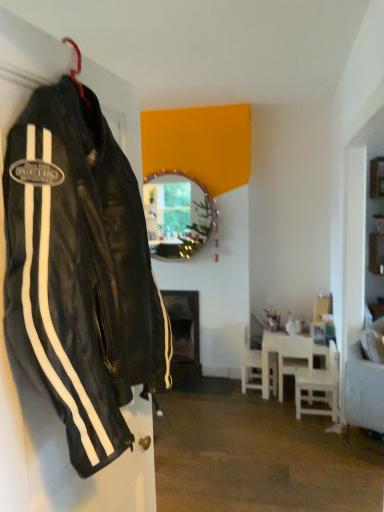
Question: Considering the relative positions of white wooden table at lower right and white plastic chair at lower right, which appears as the third chair when viewed from the front, in the image provided, is white wooden table at lower right to the right of white plastic chair at lower right, which appears as the third chair when viewed from the front, from the viewer's perspective?

Choices:
 (A) yes
 (B) no

Answer: (A)

Question: Is white wooden table at lower right to the left of white plastic chair at lower right, arranged as the 1th chair when viewed from the back, from the viewer's perspective?

Choices:
 (A) no
 (B) yes

Answer: (A)

Question: From the image's perspective, does white wooden table at lower right appear lower than white plastic chair at lower right, which appears as the third chair when viewed from the front?

Choices:
 (A) no
 (B) yes

Answer: (B)

Question: Considering the relative sizes of white wooden table at lower right and white plastic chair at lower right, arranged as the 1th chair when viewed from the back, in the image provided, is white wooden table at lower right thinner than white plastic chair at lower right, arranged as the 1th chair when viewed from the back,?

Choices:
 (A) yes
 (B) no

Answer: (B)

Question: Considering the relative sizes of white wooden table at lower right and white plastic chair at lower right, arranged as the 1th chair when viewed from the back, in the image provided, is white wooden table at lower right shorter than white plastic chair at lower right, arranged as the 1th chair when viewed from the back,?

Choices:
 (A) no
 (B) yes

Answer: (B)

Question: From their relative heights in the image, would you say shiny metallic mirror at center is taller or shorter than white plastic chair at lower right, arranged as the third chair when viewed from the back?

Choices:
 (A) short
 (B) tall

Answer: (B)

Question: From a real-world perspective, relative to white plastic chair at lower right, which appears as the first chair when viewed from the front, is shiny metallic mirror at center vertically above or below?

Choices:
 (A) above
 (B) below

Answer: (A)

Question: Is shiny metallic mirror at center to the left or to the right of white plastic chair at lower right, arranged as the third chair when viewed from the back, in the image?

Choices:
 (A) left
 (B) right

Answer: (A)

Question: Is shiny metallic mirror at center inside or outside of white plastic chair at lower right, which appears as the first chair when viewed from the front?

Choices:
 (A) inside
 (B) outside

Answer: (B)

Question: Is white plastic chair at lower right, arranged as the 1th chair when viewed from the back, wider or thinner than white wooden chair at lower right, which is the second chair in front-to-back order?

Choices:
 (A) thin
 (B) wide

Answer: (B)

Question: From the image's perspective, is white plastic chair at lower right, which appears as the third chair when viewed from the front, above or below white wooden chair at lower right, positioned as the 2th chair in back-to-front order?

Choices:
 (A) above
 (B) below

Answer: (A)

Question: Is white plastic chair at lower right, arranged as the 1th chair when viewed from the back, situated inside white wooden chair at lower right, positioned as the 2th chair in back-to-front order, or outside?

Choices:
 (A) outside
 (B) inside

Answer: (A)

Question: Considering the positions of white plastic chair at lower right, which appears as the third chair when viewed from the front, and white wooden chair at lower right, positioned as the 2th chair in back-to-front order, in the image, is white plastic chair at lower right, which appears as the third chair when viewed from the front, bigger or smaller than white wooden chair at lower right, positioned as the 2th chair in back-to-front order,?

Choices:
 (A) big
 (B) small

Answer: (A)

Question: Is white plastic chair at lower right, arranged as the 1th chair when viewed from the back, situated inside black leather jacket at left or outside?

Choices:
 (A) outside
 (B) inside

Answer: (A)

Question: In terms of height, does white plastic chair at lower right, arranged as the 1th chair when viewed from the back, look taller or shorter compared to black leather jacket at left?

Choices:
 (A) short
 (B) tall

Answer: (A)